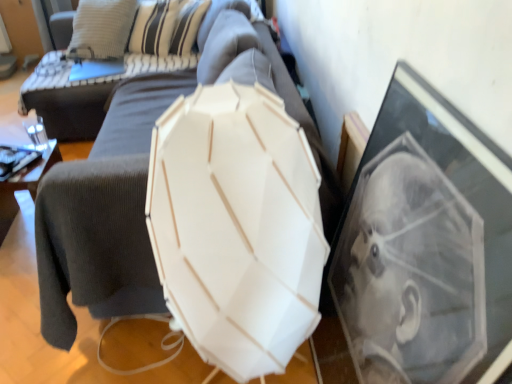
The image size is (512, 384). Find the location of `white matte umbrella at center`. white matte umbrella at center is located at coordinates (237, 227).

Locate an element on the screen. The image size is (512, 384). white matte lampshade at center is located at coordinates click(141, 185).

You are a GUI agent. You are given a task and a screenshot of the screen. Output one action in this format:
    pyautogui.click(x=<x>, y=<y>)
    Task: Click on the white matte umbrella at center
    This screenshot has height=384, width=512.
    Given the screenshot: What is the action you would take?
    pyautogui.click(x=237, y=227)

Identify the location of furniture below the white matte lampshade at center (from the image's perspective). (25, 185).

Does dark gray corduroy armchair at left have a greater height compared to white matte lampshade at center?

No.

From a real-world perspective, which object stands above the other?

white matte lampshade at center is physically above.

Is dark gray corduroy armchair at left positioned far away from white matte lampshade at center?

Yes, dark gray corduroy armchair at left is far from white matte lampshade at center.

Does dark gray corduroy armchair at left contain dark gray fabric couch at center?

Definitely not — dark gray fabric couch at center is not inside dark gray corduroy armchair at left.

Is dark gray corduroy armchair at left further to camera compared to dark gray fabric couch at center?

No, dark gray corduroy armchair at left is closer to the camera.

Considering the relative sizes of dark gray corduroy armchair at left and dark gray fabric couch at center in the image provided, is dark gray corduroy armchair at left thinner than dark gray fabric couch at center?

Indeed, dark gray corduroy armchair at left has a lesser width compared to dark gray fabric couch at center.

Can you confirm if dark gray corduroy armchair at left is bigger than dark gray fabric couch at center?

No.

Between white matte lampshade at center and dark gray fabric couch at center, which one has larger width?

white matte lampshade at center.

How different are the orientations of white matte lampshade at center and dark gray fabric couch at center in degrees?

The angle between the facing direction of white matte lampshade at center and the facing direction of dark gray fabric couch at center is 90 degrees.

Is white matte lampshade at center positioned in front of dark gray fabric couch at center?

Yes, it is.

Which of these two, white matte lampshade at center or dark gray fabric couch at center, stands taller?

dark gray fabric couch at center is taller.

Is white matte lampshade at center not inside white matte umbrella at center?

Yes, white matte lampshade at center is located beyond the bounds of white matte umbrella at center.

Is white matte umbrella at center at the back of white matte lampshade at center?

No, white matte lampshade at center's orientation is not away from white matte umbrella at center.

Does point (251, 46) lie in front of point (284, 192)?

No.

From a real-world perspective, is white matte lampshade at center positioned over white matte umbrella at center based on gravity?

Incorrect, from a real-world perspective, white matte lampshade at center is lower than white matte umbrella at center.

Looking at the image, does white matte umbrella at center seem bigger or smaller compared to dark gray fabric couch at center?

white matte umbrella at center is smaller than dark gray fabric couch at center.

Does white matte umbrella at center have a greater height compared to dark gray fabric couch at center?

Correct, white matte umbrella at center is much taller as dark gray fabric couch at center.

How many degrees apart are the facing directions of white matte umbrella at center and dark gray fabric couch at center?

91.3 degrees.

From the image's perspective, who appears lower, white matte umbrella at center or dark gray fabric couch at center?

From the image's view, white matte umbrella at center is below.

Is dark gray corduroy armchair at left at the back of white matte lampshade at center?

That's not correct — white matte lampshade at center is not looking away from dark gray corduroy armchair at left.

Based on the photo, from a real-world perspective, is white matte lampshade at center physically below dark gray corduroy armchair at left?

No.

Would you say white matte lampshade at center is a long distance from dark gray corduroy armchair at left?

Yes, white matte lampshade at center and dark gray corduroy armchair at left are quite far apart.

Can you confirm if white matte lampshade at center is thinner than dark gray corduroy armchair at left?

Incorrect, the width of white matte lampshade at center is not less than that of dark gray corduroy armchair at left.

Is dark gray fabric couch at center next to white matte umbrella at center?

There is a gap between dark gray fabric couch at center and white matte umbrella at center.

Consider the image. Which of these two, dark gray fabric couch at center or white matte umbrella at center, stands taller?

white matte umbrella at center.

Is dark gray fabric couch at center oriented away from white matte umbrella at center?

No, dark gray fabric couch at center is not facing away from white matte umbrella at center.

You are a GUI agent. You are given a task and a screenshot of the screen. Output one action in this format:
    pyautogui.click(x=<x>, y=<y>)
    Task: Click on the umbrella below the dark gray fabric couch at center (from the image's perspective)
    The width and height of the screenshot is (512, 384).
    Given the screenshot: What is the action you would take?
    pyautogui.click(x=237, y=227)

I want to click on swivel chair on the right of dark gray corduroy armchair at left, so click(141, 185).

Locate an element on the screen. The width and height of the screenshot is (512, 384). furniture on the left of dark gray fabric couch at center is located at coordinates (25, 185).

From the picture: Estimate the real-world distances between objects in this image. Which object is further from dark gray fabric couch at center, dark gray corduroy armchair at left or white matte umbrella at center?

white matte umbrella at center.

From the image, which object appears to be farther from dark gray fabric couch at center, white matte umbrella at center or dark gray corduroy armchair at left?

white matte umbrella at center.

When comparing their distances from white matte umbrella at center, does dark gray fabric couch at center or white matte lampshade at center seem further?

dark gray fabric couch at center is further to white matte umbrella at center.

Considering their positions, is dark gray corduroy armchair at left positioned closer to white matte lampshade at center than dark gray fabric couch at center?

Based on the image, dark gray fabric couch at center appears to be nearer to white matte lampshade at center.

From the image, which object appears to be nearer to dark gray fabric couch at center, white matte lampshade at center or dark gray corduroy armchair at left?

dark gray corduroy armchair at left is closer to dark gray fabric couch at center.

Estimate the real-world distances between objects in this image. Which object is closer to dark gray corduroy armchair at left, dark gray fabric couch at center or white matte umbrella at center?

dark gray fabric couch at center is closer to dark gray corduroy armchair at left.

When comparing their distances from dark gray corduroy armchair at left, does white matte lampshade at center or white matte umbrella at center seem further?

white matte umbrella at center lies further to dark gray corduroy armchair at left than the other object.

Considering their positions, is dark gray corduroy armchair at left positioned closer to white matte umbrella at center than dark gray fabric couch at center?

Among the two, dark gray corduroy armchair at left is located nearer to white matte umbrella at center.

I want to click on furniture located between white matte umbrella at center and dark gray fabric couch at center in the depth direction, so click(x=25, y=185).

The height and width of the screenshot is (384, 512). I want to click on swivel chair located between white matte umbrella at center and dark gray corduroy armchair at left in the depth direction, so [141, 185].

Where is `furniture between white matte lampshade at center and dark gray fabric couch at center along the z-axis`? The image size is (512, 384). furniture between white matte lampshade at center and dark gray fabric couch at center along the z-axis is located at coordinates (25, 185).

You are a GUI agent. You are given a task and a screenshot of the screen. Output one action in this format:
    pyautogui.click(x=<x>, y=<y>)
    Task: Click on the swivel chair between white matte umbrella at center and dark gray fabric couch at center from front to back
    This screenshot has height=384, width=512.
    Given the screenshot: What is the action you would take?
    pyautogui.click(x=141, y=185)